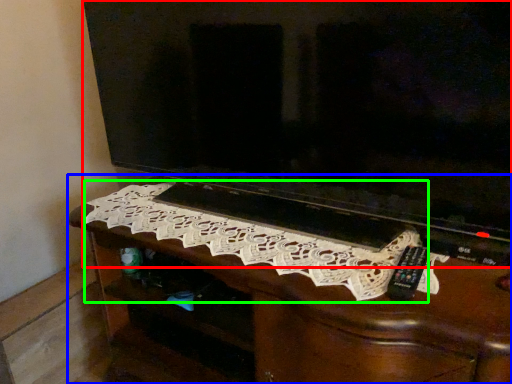
Question: Based on their relative distances, which object is nearer to television (highlighted by a red box)? Choose from furniture (highlighted by a blue box) and embroidery (highlighted by a green box).

Choices:
 (A) furniture
 (B) embroidery

Answer: (B)